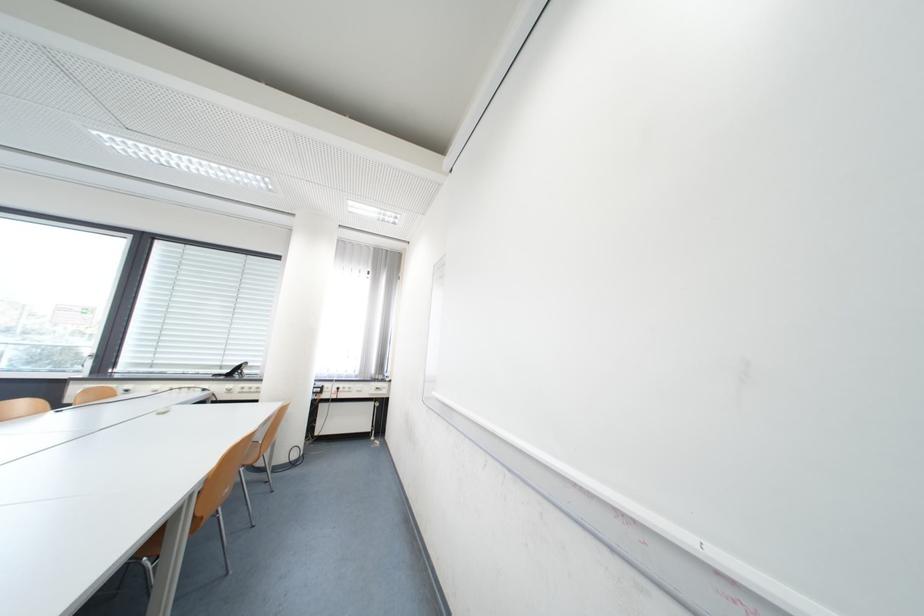
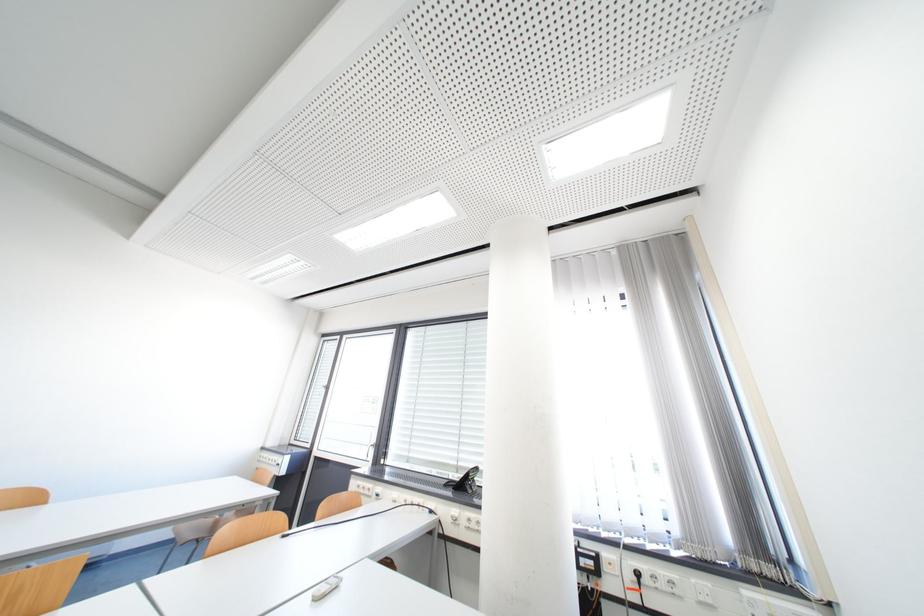
The point at (232, 368) is marked in the first image. Where is the corresponding point in the second image?

(468, 469)